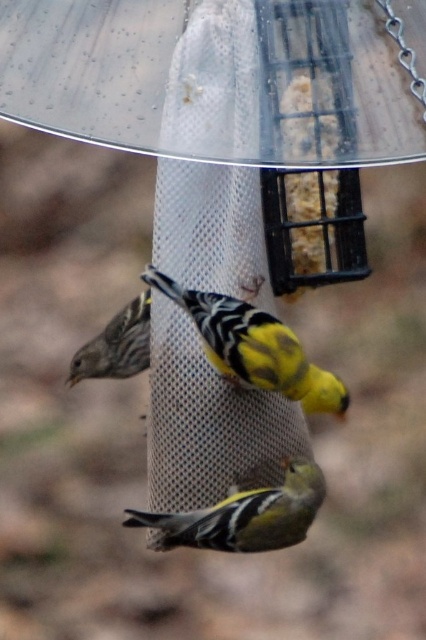
Between yellow-green feathers at center and matte brown pinecone at left, which one appears on the left side from the viewer's perspective?

Positioned to the left is matte brown pinecone at left.

Where is `yellow-green feathers at center`? This screenshot has width=426, height=640. yellow-green feathers at center is located at coordinates (242, 515).

Does point (256, 372) come farther from viewer compared to point (141, 355)?

That is False.

Is yellow matte sparrow at center shorter than matte brown pinecone at left?

Incorrect, yellow matte sparrow at center's height does not fall short of matte brown pinecone at left's.

Between point (340, 410) and point (74, 364), which one is positioned behind?

The point (74, 364) is behind.

The image size is (426, 640). I want to click on yellow matte sparrow at center, so click(x=253, y=348).

Can you confirm if yellow matte sparrow at center is thinner than yellow-green feathers at center?

No.

Does yellow matte sparrow at center have a larger size compared to yellow-green feathers at center?

Indeed, yellow matte sparrow at center has a larger size compared to yellow-green feathers at center.

Describe the element at coordinates (253, 348) in the screenshot. I see `yellow matte sparrow at center` at that location.

This screenshot has height=640, width=426. I want to click on yellow matte sparrow at center, so click(x=253, y=348).